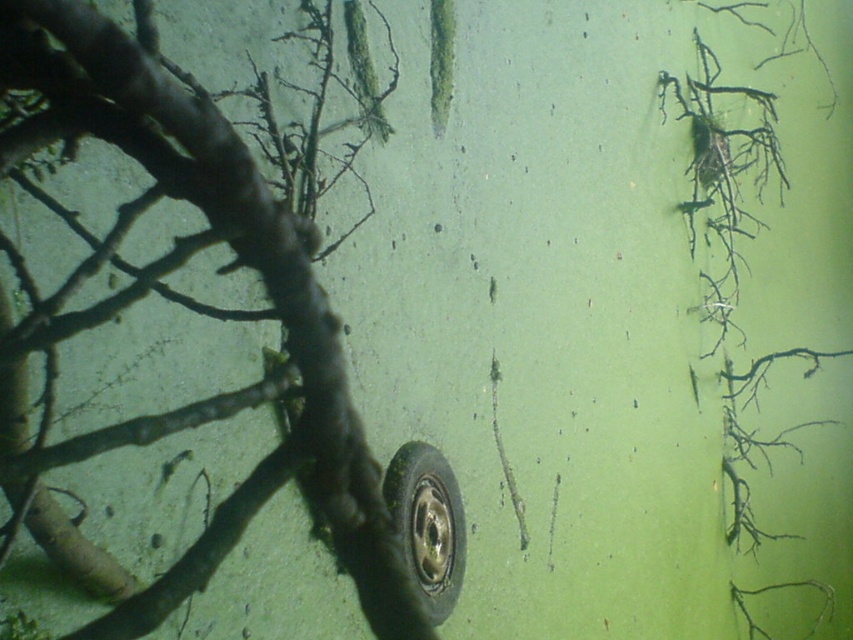
Between point (67, 6) and point (405, 508), which one is positioned in front?

Point (67, 6) is more forward.

Does brown rough branch at center have a greater width compared to black rubber tire at center?

Yes.

I want to click on brown rough branch at center, so click(265, 289).